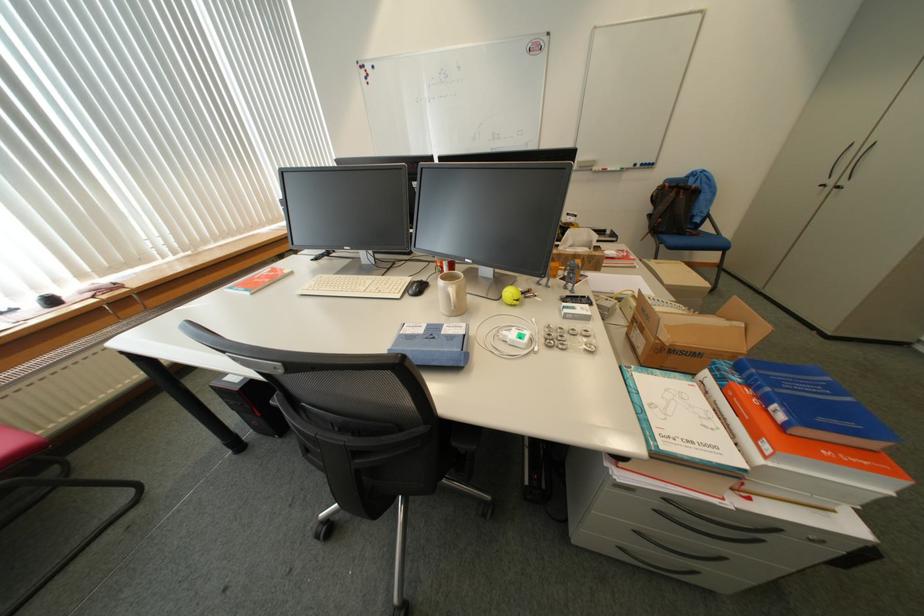
At what (x,y) coordinates should I click in order to perform the action: click on black computer mouse. Please return your answer as a coordinate pair (x, y). Looking at the image, I should click on (417, 286).